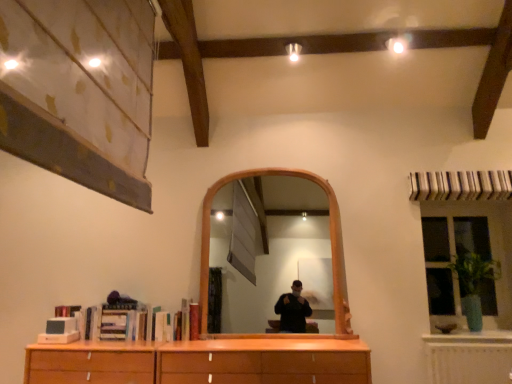
Question: Would you say green glossy vase at right is to the left or to the right of green glass vase at right in the picture?

Choices:
 (A) left
 (B) right

Answer: (A)

Question: In terms of height, does green glossy vase at right look taller or shorter compared to green glass vase at right?

Choices:
 (A) tall
 (B) short

Answer: (B)

Question: Relative to green glass vase at right, is green glossy vase at right in front or behind?

Choices:
 (A) front
 (B) behind

Answer: (A)

Question: Choose the correct answer: Is green glass vase at right inside green glossy vase at right or outside it?

Choices:
 (A) outside
 (B) inside

Answer: (A)

Question: Considering the positions of green glass vase at right and green glossy vase at right in the image, is green glass vase at right taller or shorter than green glossy vase at right?

Choices:
 (A) tall
 (B) short

Answer: (A)

Question: Looking at their shapes, would you say green glass vase at right is wider or thinner than green glossy vase at right?

Choices:
 (A) wide
 (B) thin

Answer: (B)

Question: In the image, is green glass vase at right on the left side or the right side of green glossy vase at right?

Choices:
 (A) left
 (B) right

Answer: (B)